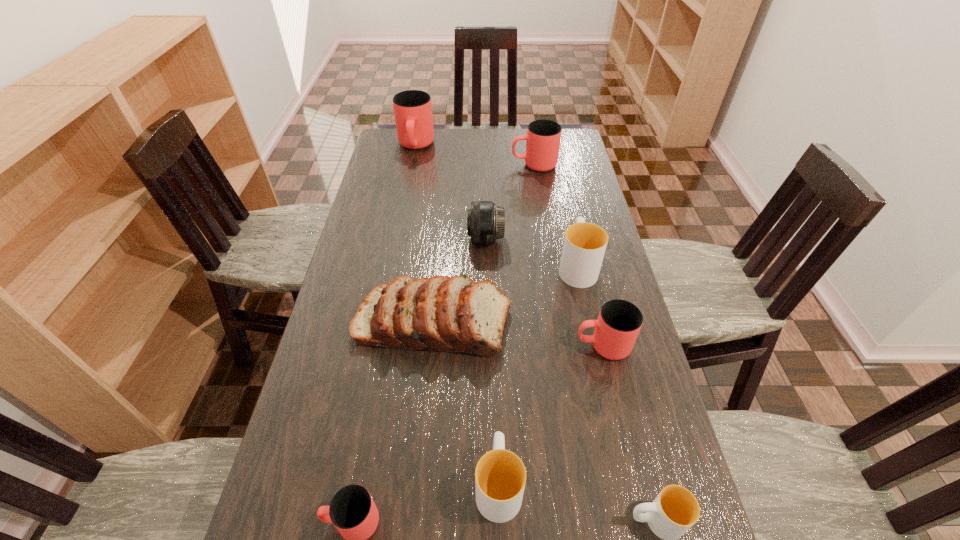
This screenshot has width=960, height=540. I want to click on free space that satisfies the following two spatial constraints: 1. on the handle side of the fourth nearest cup; 2. on the front-facing side of the telephoto lens, so click(x=578, y=239).

Locate an element on the screen. Image resolution: width=960 pixels, height=540 pixels. vacant region that satisfies the following two spatial constraints: 1. on the front side of the bread; 2. on the handle side of the fourth farthest cup is located at coordinates (430, 346).

Where is `free spot that satisfies the following two spatial constraints: 1. with the handle on the side of the second smallest yellow cup; 2. on the handle side of the third smallest pink cup`? This screenshot has height=540, width=960. free spot that satisfies the following two spatial constraints: 1. with the handle on the side of the second smallest yellow cup; 2. on the handle side of the third smallest pink cup is located at coordinates coord(490,165).